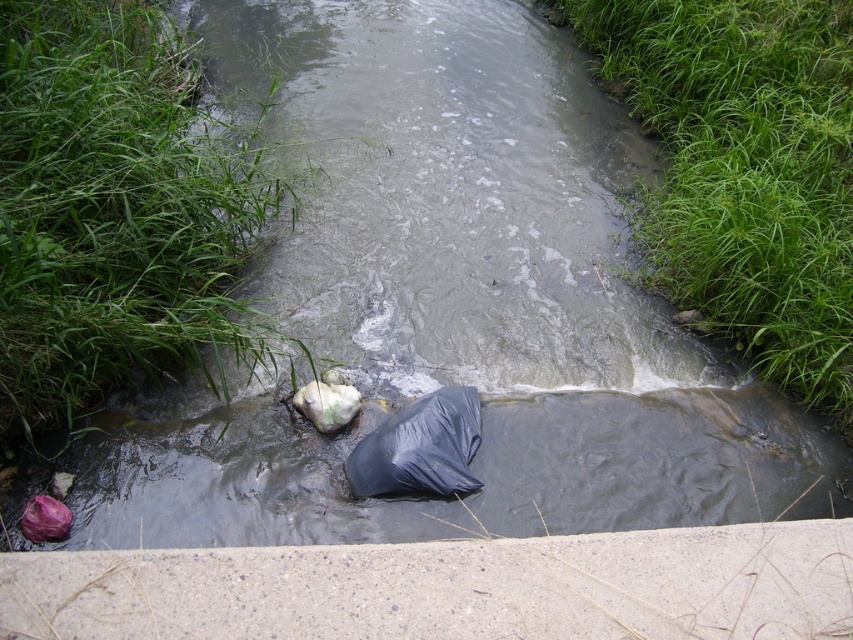
Who is more forward, (254, 346) or (646, 122)?

Positioned in front is point (254, 346).

Can you confirm if green grass at lower left is positioned to the right of green grass at upper right?

No, green grass at lower left is not to the right of green grass at upper right.

Is point (47, 308) closer to camera compared to point (601, 42)?

Yes.

The height and width of the screenshot is (640, 853). In order to click on green grass at lower left in this screenshot , I will do point(114,208).

Can you confirm if green grass at upper right is shorter than black plastic bag at center?

Incorrect, green grass at upper right's height does not fall short of black plastic bag at center's.

Who is taller, green grass at upper right or black plastic bag at center?

With more height is green grass at upper right.

Where is `green grass at upper right`? Image resolution: width=853 pixels, height=640 pixels. green grass at upper right is located at coordinates (746, 170).

Where is `green grass at upper right`? The height and width of the screenshot is (640, 853). green grass at upper right is located at coordinates (746, 170).

From the picture: Is green grass at lower left above black plastic bag at center?

Yes.

Can you confirm if green grass at lower left is bigger than black plastic bag at center?

Yes.

Who is more forward, (112,268) or (358,474)?

Point (358,474)

What are the coordinates of `green grass at lower left` in the screenshot? It's located at (114, 208).